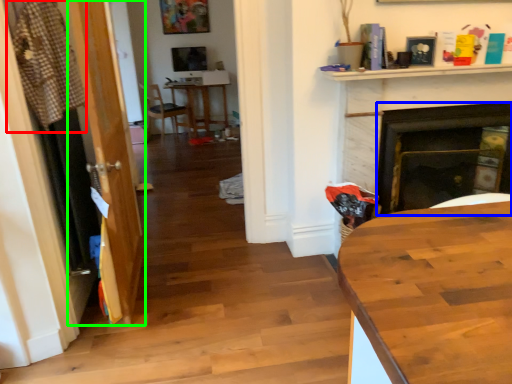
Question: Which object is positioned farthest from laundry (highlighted by a red box)? Select from fireplace (highlighted by a blue box) and glass door (highlighted by a green box).

Choices:
 (A) fireplace
 (B) glass door

Answer: (A)